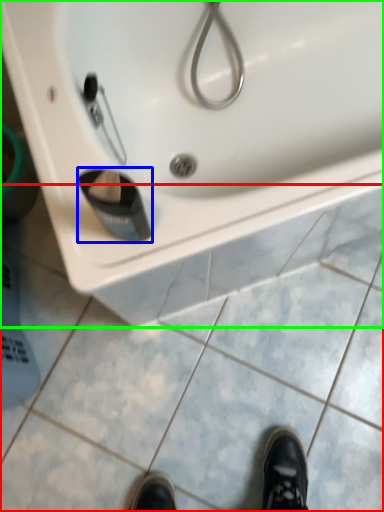
Question: Considering the real-world distances, which object is closest to tile (highlighted by a red box)? liquid (highlighted by a blue box) or sink (highlighted by a green box).

Choices:
 (A) liquid
 (B) sink

Answer: (B)